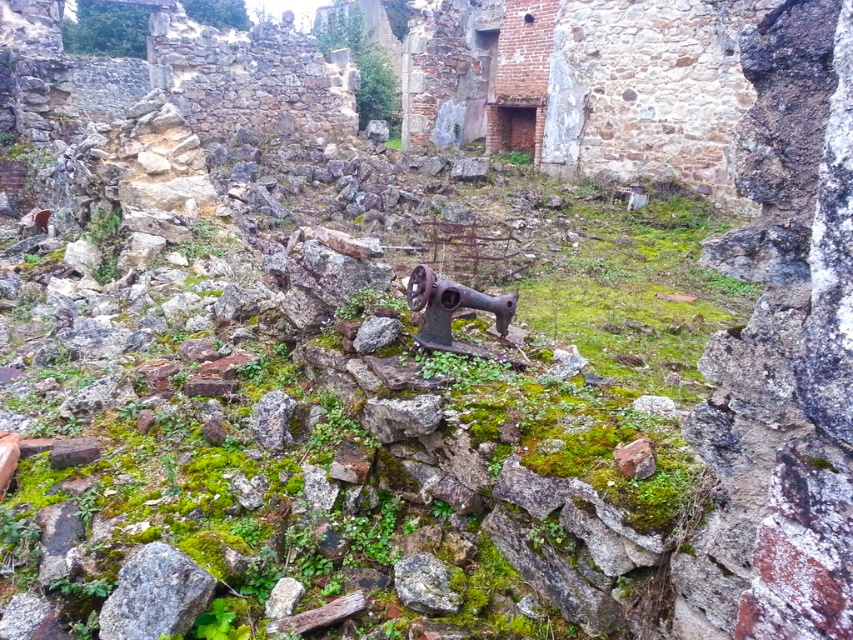
You are a photographer trying to capture the rusty metal sewing machine at center. To ensure the gray rough stone at lower left is visible in the background, where should you position the camera relative to the sewing machine?

The gray rough stone at lower left is positioned under the rusty metal sewing machine at center, so positioning the camera above the sewing machine would allow the gray rough stone at lower left to be seen in the background.

You are standing in front of the abandoned stone structure and notice two points marked on the wall. Which point, point (212, 577) or point (430, 332), is closer to you?

Point (212, 577) is closer to the viewer than point (430, 332).

You are a treasure hunter exploring the abandoned stone structure. You have a map that marks a point at coordinates (451, 312). What object is located at that point?

The point at coordinates (451, 312) marks the location of the rusty metal sewing machine at center.